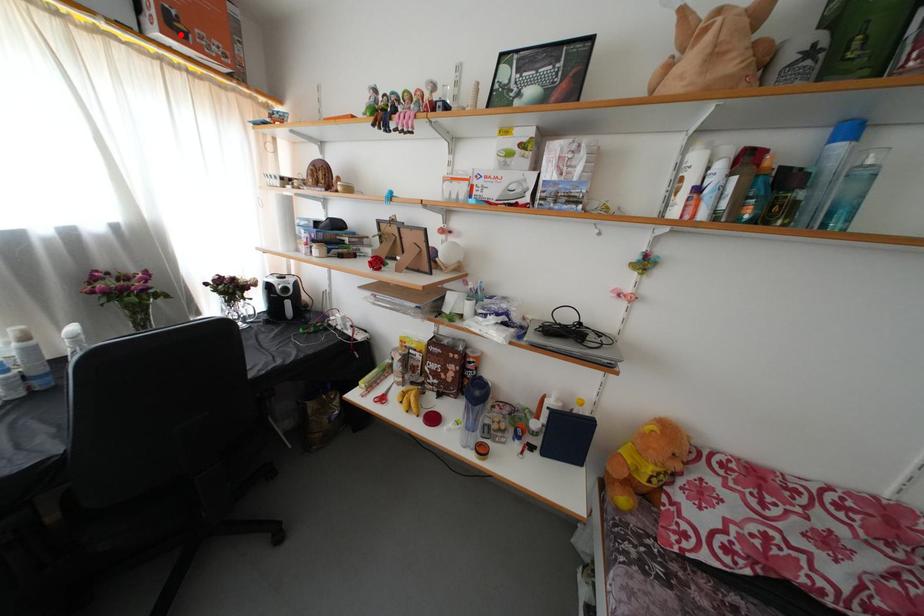
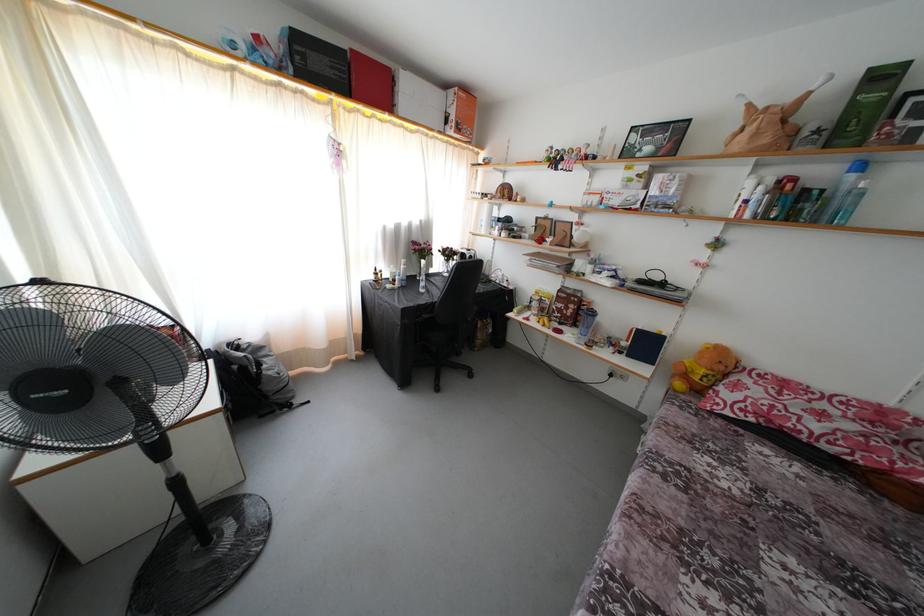
Locate, in the second image, the point that corresponds to the highlighted location in the first image.

(463, 134)